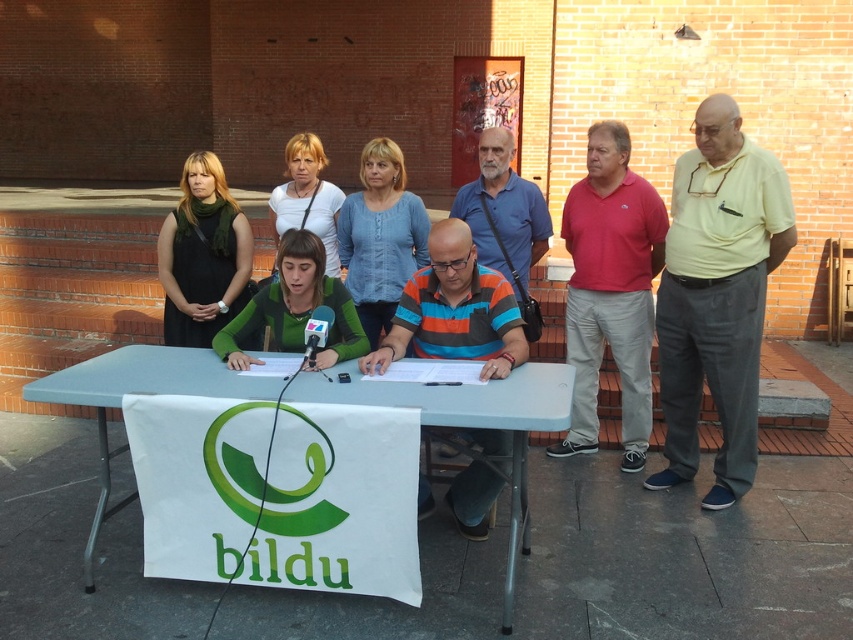
You are organizing a photo shoot and need to arrange two shirts based on their sizes. The yellow smooth shirt at right and the green matte shirt at center are available. Which shirt should you choose if you need the larger one?

The yellow smooth shirt at right is larger in size than the green matte shirt at center, so you should choose the yellow smooth shirt at right.

You are a photographer standing at the edge of the plaza. You need to capture a photo of the blue cotton shirt at center. Based on the coordinates provided, where should you aim your camera?

The blue cotton shirt at center is located at coordinates point (380, 236), so you should aim your camera towards that position to capture it.

You are a photographer positioned in front of the table where the group is standing. You need to take a photo that includes both the pink cotton polo shirt at right and the matte white shirt at center. Which shirt will appear larger in the photo?

→ The pink cotton polo shirt at right will appear larger in the photo because it is closer to the photographer than the matte white shirt at center.